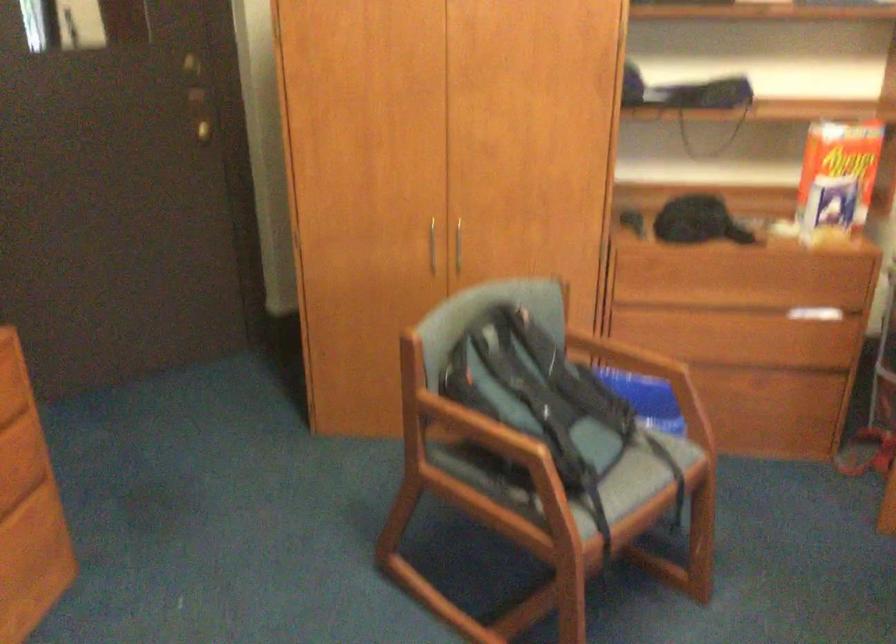
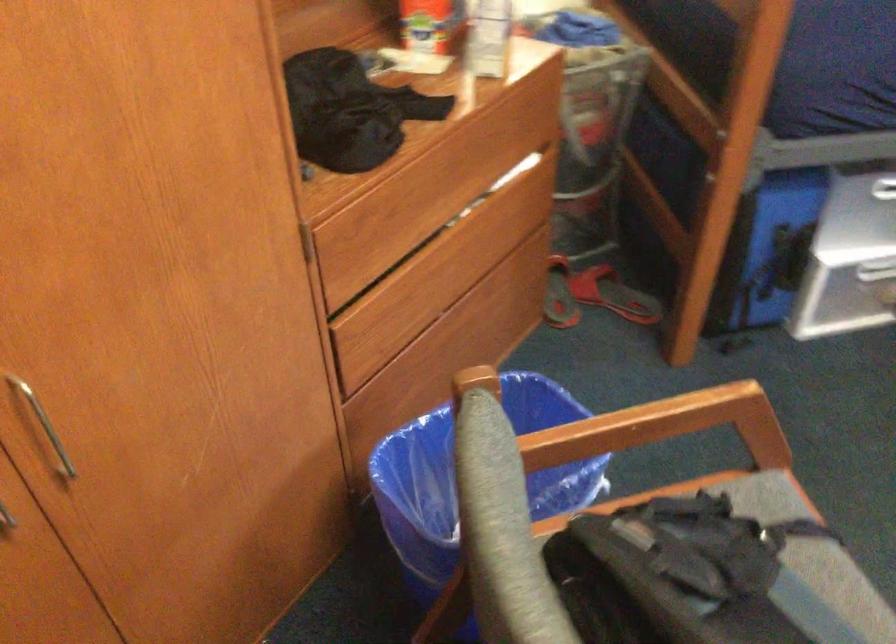
Where in the second image is the point corresponding to point 643,373 from the first image?

(672, 421)